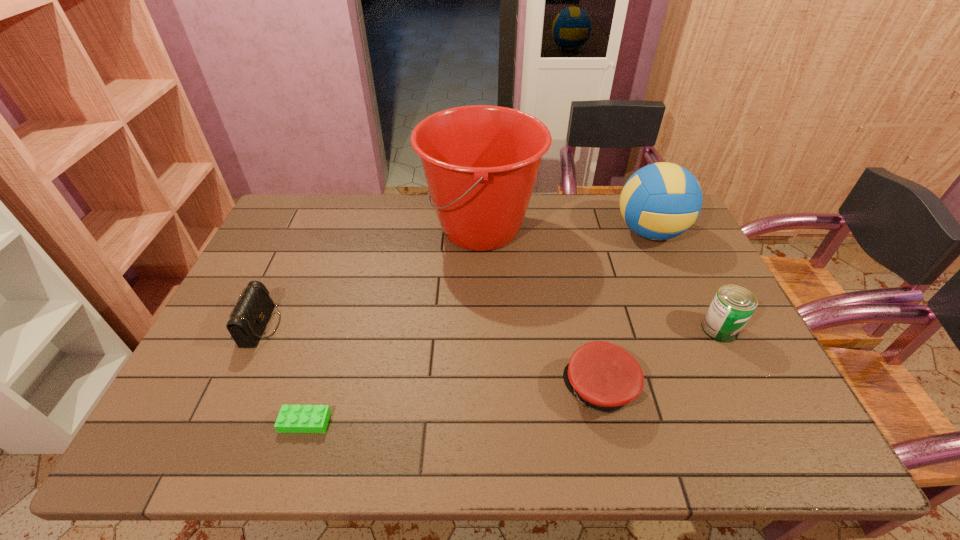
Where is `bucket`? bucket is located at coordinates (481, 162).

Where is `volleyball`? volleyball is located at coordinates (660, 201).

Identify the location of can. (733, 305).

In order to click on the leftmost object in this screenshot , I will do `click(253, 309)`.

The width and height of the screenshot is (960, 540). In order to click on clutch bag in this screenshot , I will do `click(253, 309)`.

Locate an element on the screen. The height and width of the screenshot is (540, 960). the second shortest object is located at coordinates (603, 376).

What are the coordinates of `the second object from left to right` in the screenshot? It's located at (292, 418).

Identify the location of Lego. The image size is (960, 540). (292, 418).

Locate an element on the screen. This screenshot has width=960, height=540. vacant space located with the handle attached to the rim of the bucket is located at coordinates (323, 229).

What are the coordinates of `free spot located 0.050m with the handle attached to the rim of the bucket` in the screenshot? It's located at (406, 229).